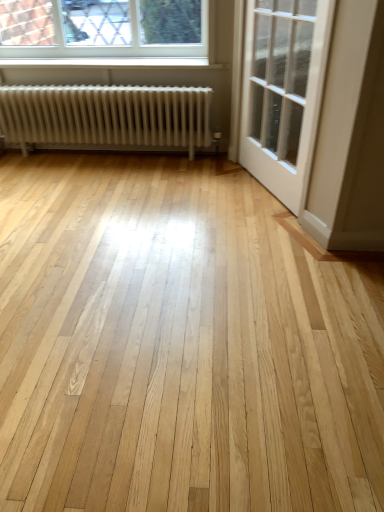
Locate an element on the screen. free spot below white glossy door at upper right (from a real-world perspective) is located at coordinates (263, 189).